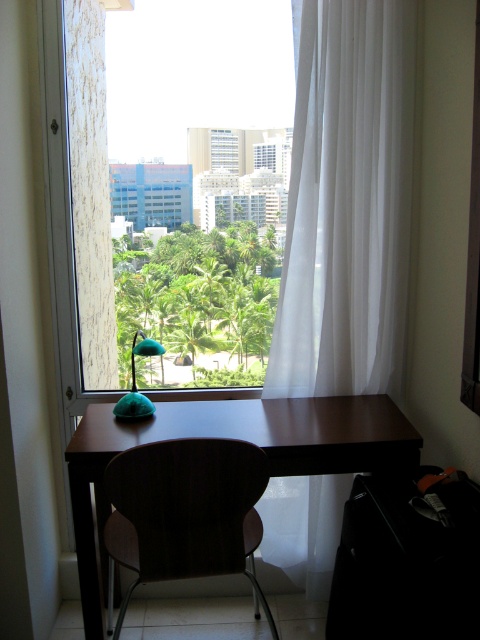
You are sitting at the dark wood table at center and want to reach the teal fabric lamp at lower left. Which direction should you move to get closer to the lamp?

The dark wood table at center is below the teal fabric lamp at lower left, so you should move upward to get closer to the teal fabric lamp at lower left.

You are organizing a photo shoot and need to position a model in front of the transparent glass window at center and the teal fabric lamp at lower left. According to the scene, where should the model stand relative to both objects to ensure both are visible in the frame?

The model should stand to the left of the teal fabric lamp at lower left so that the transparent glass window at center is to their right and the teal fabric lamp at lower left is to their left, ensuring both objects are in the frame.